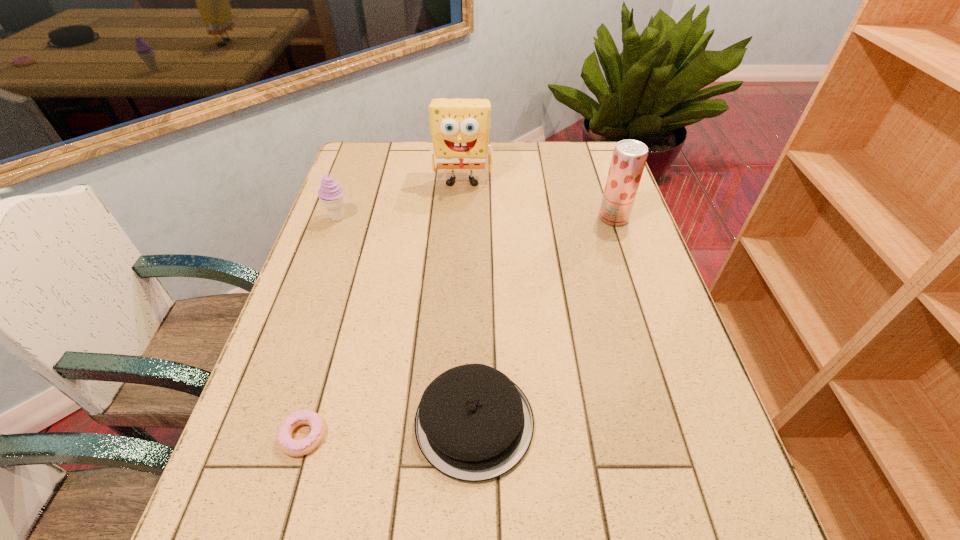
You are a GUI agent. You are given a task and a screenshot of the screen. Output one action in this format:
    pyautogui.click(x=<x>, y=<y>)
    Task: Click on the vacant area that lies between the sponge and the rightmost object
    
    Given the screenshot: What is the action you would take?
    pyautogui.click(x=538, y=199)

Find the location of a particular element. free spot between the icecream and the fourth tallest object is located at coordinates (406, 320).

In order to click on object that is the closest one to the fourth object from right to left in this screenshot , I will do `click(473, 423)`.

Locate which object is the second closest to the farthest object. Please provide its 2D coordinates. Your answer should be formatted as a tuple, i.e. [(x, y)], where the tuple contains the x and y coordinates of a point satisfying the conditions above.

[(629, 157)]

I want to click on blank area in the image that satisfies the following two spatial constraints: 1. on the face of the fruit juice; 2. on the right side of the sponge, so click(461, 218).

At what (x,y) coordinates should I click in order to perform the action: click on free space that satisfies the following two spatial constraints: 1. on the back side of the rightmost object; 2. on the left side of the leftmost object. Please return your answer as a coordinate pair (x, y). This screenshot has width=960, height=540. Looking at the image, I should click on 339,218.